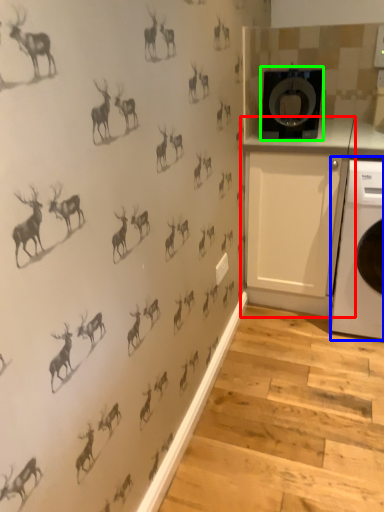
Question: Which is farther away from cabinetry (highlighted by a red box)? home appliance (highlighted by a blue box) or washing machine (highlighted by a green box)?

Choices:
 (A) home appliance
 (B) washing machine

Answer: (B)